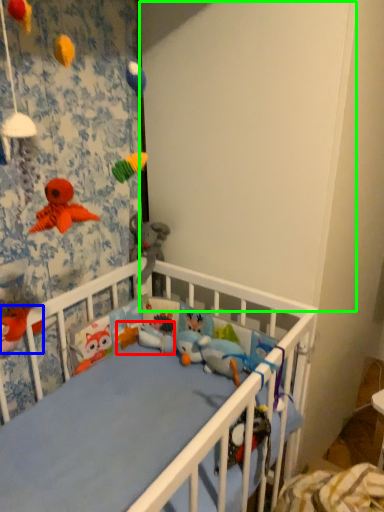
Question: Which is nearer to the toy (highlighted by a red box)? toy (highlighted by a blue box) or backdrop (highlighted by a green box).

Choices:
 (A) toy
 (B) backdrop

Answer: (A)